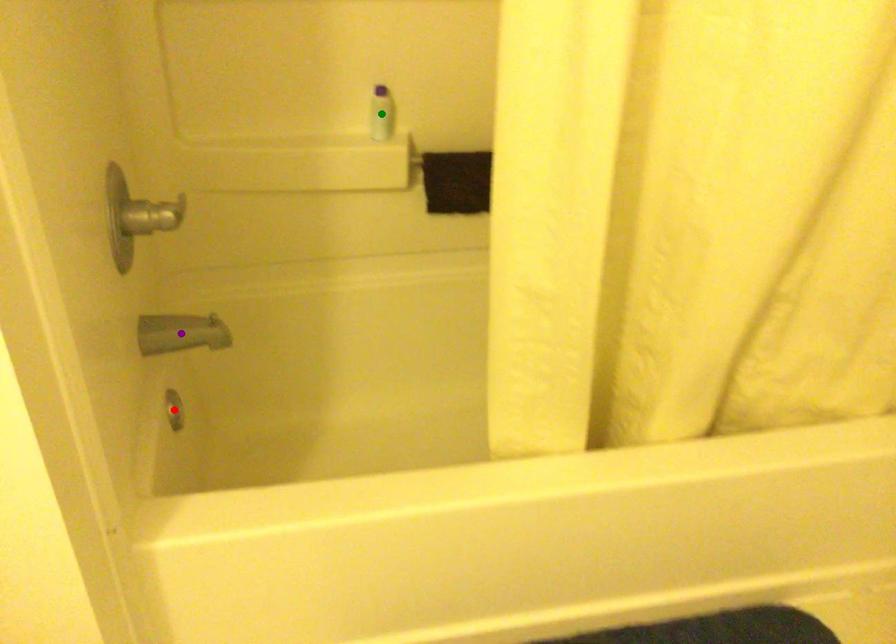
Order these from nearest to farthest:
A) purple point
B) green point
C) red point

green point < red point < purple point